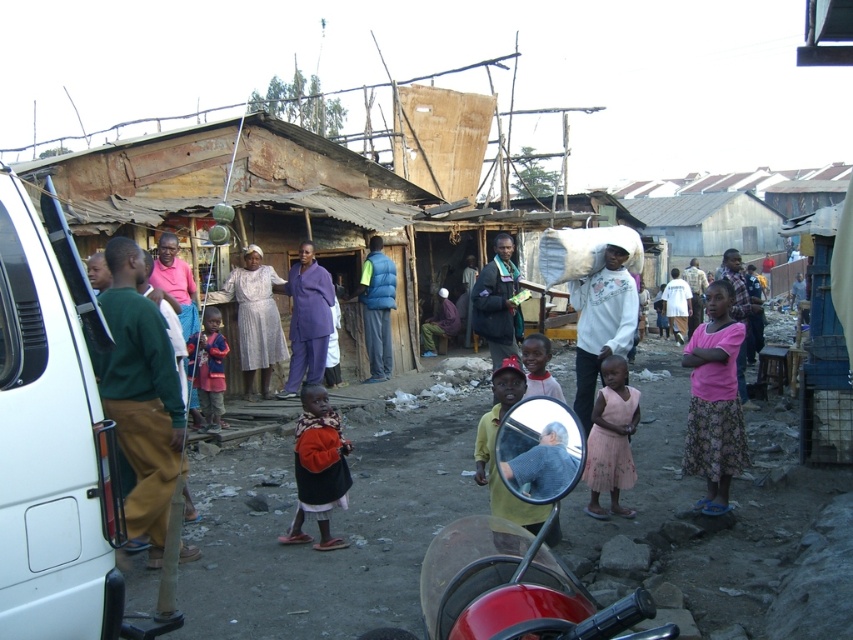
Question: Does green cotton sweater at left appear on the left side of purple fabric at center?

Choices:
 (A) no
 (B) yes

Answer: (B)

Question: Estimate the real-world distances between objects in this image. Which object is closer to the orange fabric dress at center?

Choices:
 (A) pink pleated dress at lower right
 (B) dark blue jacket at center
 (C) light gray fabric dress at center

Answer: (A)

Question: Which point is farther to the camera?

Choices:
 (A) (471, 307)
 (B) (421, 352)
 (C) (291, 282)

Answer: (B)

Question: Among these points, which one is farthest from the camera?

Choices:
 (A) (596, 451)
 (B) (303, 467)
 (C) (212, 360)
 (D) (517, 310)

Answer: (C)

Question: Does green cotton sweater at left have a smaller size compared to purple fabric at center?

Choices:
 (A) no
 (B) yes

Answer: (A)

Question: Does pink fabric skirt at center-right appear under white cotton sweatshirt at center?

Choices:
 (A) no
 (B) yes

Answer: (B)